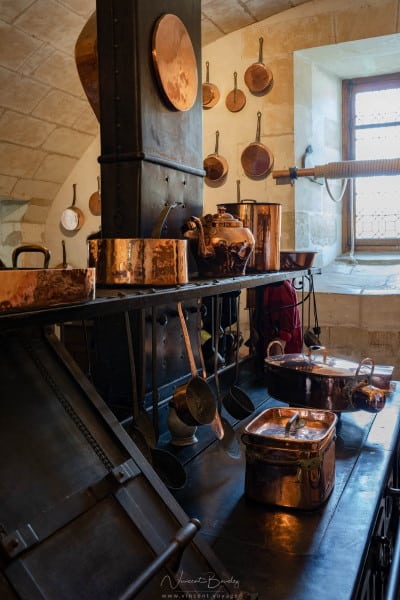
The image size is (400, 600). Find the location of `chimney`. chimney is located at coordinates (159, 148).